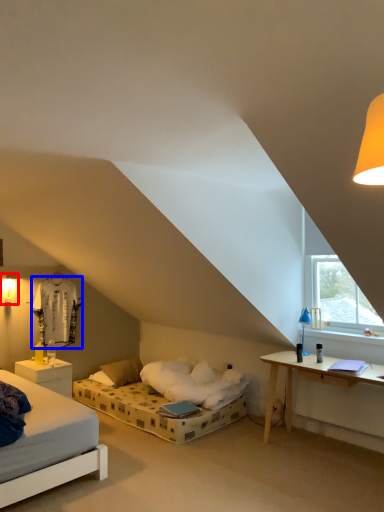
Question: Which of the following is the farthest to the observer, light fixture (highlighted by a red box) or sheet (highlighted by a blue box)?

Choices:
 (A) light fixture
 (B) sheet

Answer: (B)